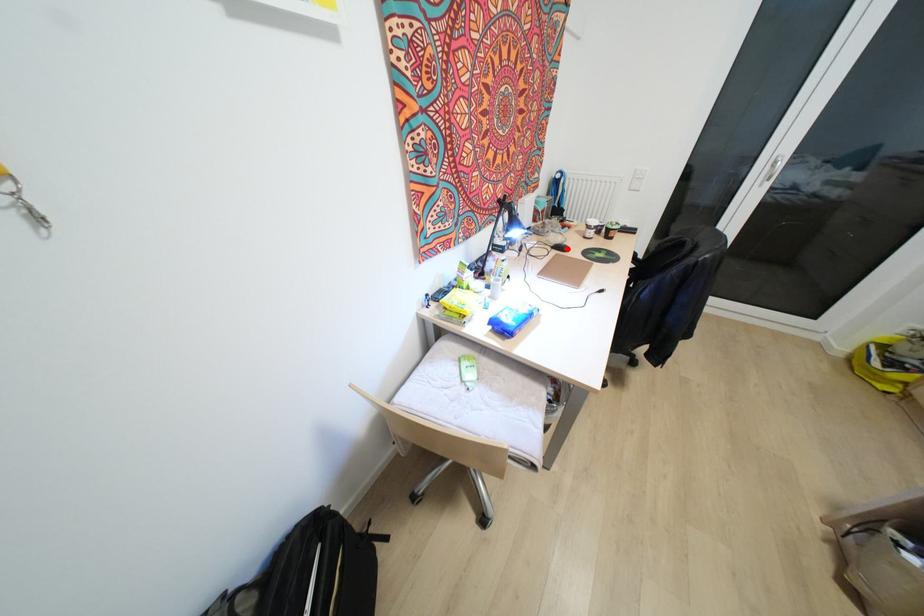
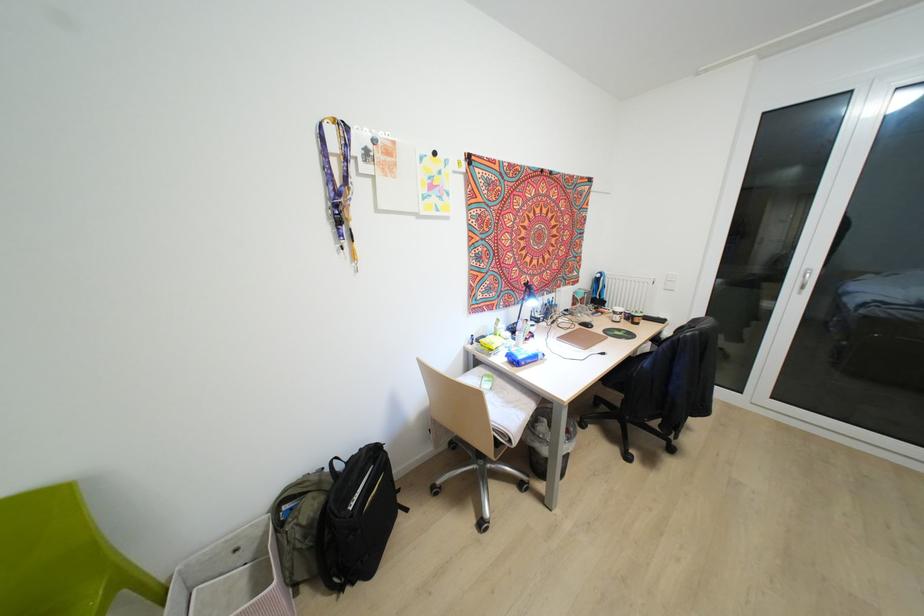
Question: I am providing you with two images of the same scene from different viewpoints. A red point is marked on the first image. Is the red point's position out of view in image 2?

Choices:
 (A) Yes
 (B) No

Answer: (B)